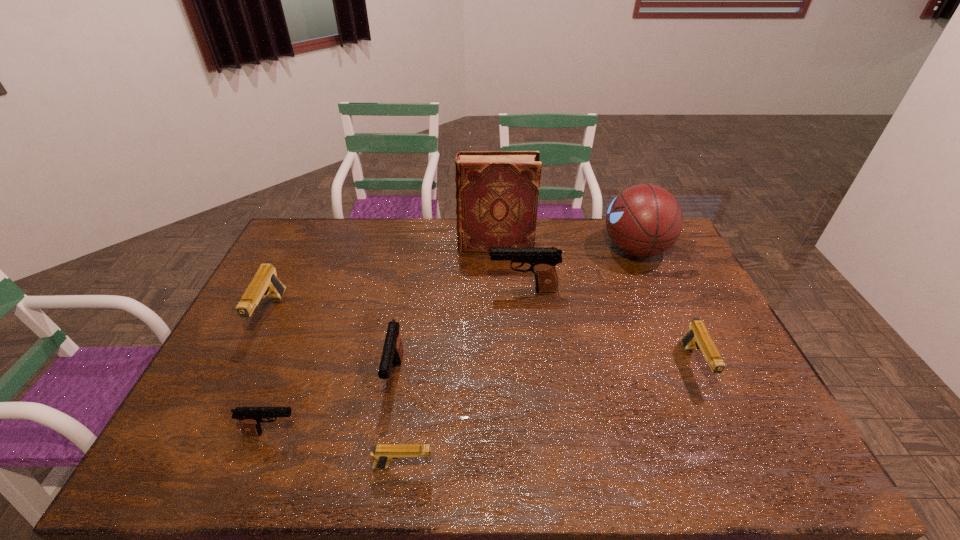
You are a GUI agent. You are given a task and a screenshot of the screen. Output one action in this format:
    pyautogui.click(x=<x>, y=<y>)
    Task: Click on the free area in between the rightmost tan pistol and the seventh object from right to left
    This screenshot has height=540, width=960.
    Given the screenshot: What is the action you would take?
    pyautogui.click(x=484, y=399)

Locate an element on the screen. The image size is (960, 540). vacant area that lies between the second biggest tan pistol and the leftmost black pistol is located at coordinates (484, 399).

You are a GUI agent. You are given a task and a screenshot of the screen. Output one action in this format:
    pyautogui.click(x=<x>, y=<y>)
    Task: Click on the blank region between the second biggest black pistol and the biggest tan pistol
    This screenshot has width=960, height=540.
    Given the screenshot: What is the action you would take?
    pyautogui.click(x=333, y=346)

The height and width of the screenshot is (540, 960). I want to click on free space between the tallest object and the second biggest black pistol, so click(445, 310).

Locate an element on the screen. This screenshot has width=960, height=540. vacant space in between the second black pistol from right to left and the rightmost tan pistol is located at coordinates (544, 371).

You are a GUI agent. You are given a task and a screenshot of the screen. Output one action in this format:
    pyautogui.click(x=<x>, y=<y>)
    Task: Click on the free space between the second tallest object and the second black pistol from left to right
    
    Given the screenshot: What is the action you would take?
    pyautogui.click(x=516, y=313)

Locate an element on the screen. free spot between the rightmost pistol and the second biggest black pistol is located at coordinates (544, 371).

Identify the location of free point between the hardback book and the biggest tan pistol. (383, 280).

Image resolution: width=960 pixels, height=540 pixels. What are the coordinates of `object identified as the sixth closest to the second smallest tan pistol` in the screenshot? It's located at (250, 418).

Locate which object is the closest to the rightmost black pistol. Please provide its 2D coordinates. Your answer should be formatted as a tuple, i.e. [(x, y)], where the tuple contains the x and y coordinates of a point satisfying the conditions above.

[(497, 192)]